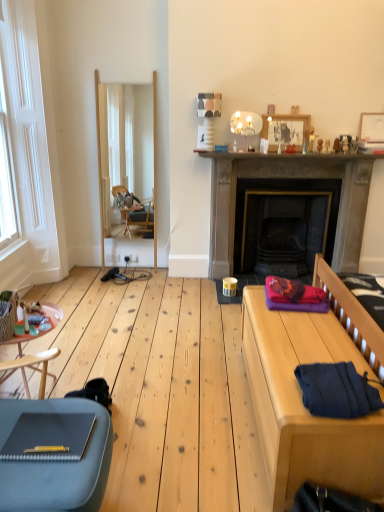
Question: Is dark gray stone fireplace at center not within wooden picture frame at upper right, the second picture frame in the left-to-right sequence?

Choices:
 (A) yes
 (B) no

Answer: (A)

Question: Is dark gray stone fireplace at center not close to wooden picture frame at upper right, the first picture frame from the right?

Choices:
 (A) no
 (B) yes

Answer: (A)

Question: From a real-world perspective, is dark gray stone fireplace at center located higher than wooden picture frame at upper right, the first picture frame from the right?

Choices:
 (A) yes
 (B) no

Answer: (B)

Question: Considering the relative sizes of dark gray stone fireplace at center and wooden picture frame at upper right, the first picture frame from the right, in the image provided, is dark gray stone fireplace at center bigger than wooden picture frame at upper right, the first picture frame from the right,?

Choices:
 (A) no
 (B) yes

Answer: (B)

Question: Is dark gray stone fireplace at center shorter than wooden picture frame at upper right, the first picture frame from the right?

Choices:
 (A) no
 (B) yes

Answer: (A)

Question: Is dark gray stone fireplace at center looking in the opposite direction of wooden picture frame at upper right, the first picture frame from the right?

Choices:
 (A) no
 (B) yes

Answer: (A)

Question: From a real-world perspective, is wooden bed frame at right under wooden frame mirror at center?

Choices:
 (A) no
 (B) yes

Answer: (B)

Question: Can you confirm if wooden bed frame at right is thinner than wooden frame mirror at center?

Choices:
 (A) no
 (B) yes

Answer: (A)

Question: Would you say wooden frame mirror at center is part of wooden bed frame at right's contents?

Choices:
 (A) no
 (B) yes

Answer: (A)

Question: Does wooden bed frame at right have a smaller size compared to wooden frame mirror at center?

Choices:
 (A) yes
 (B) no

Answer: (B)

Question: Is wooden bed frame at right positioned behind wooden frame mirror at center?

Choices:
 (A) yes
 (B) no

Answer: (B)

Question: From the image's perspective, is wooden bed frame at right under wooden frame mirror at center?

Choices:
 (A) yes
 (B) no

Answer: (A)

Question: Is wooden side table at lower left shorter than wooden picture frame at upper center, acting as the 2th picture frame starting from the right?

Choices:
 (A) no
 (B) yes

Answer: (A)